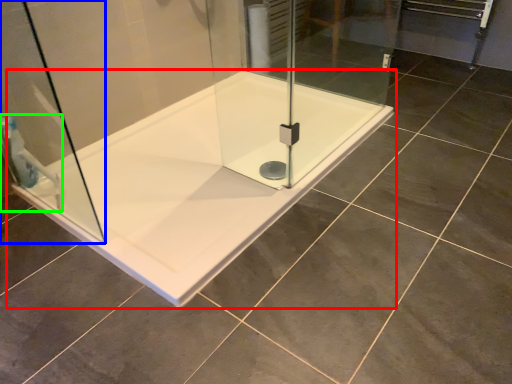
Question: Estimate the real-world distances between objects in this image. Which object is closer to bathtub (highlighted by a red box), shower door (highlighted by a blue box) or shower (highlighted by a green box)?

Choices:
 (A) shower door
 (B) shower

Answer: (A)